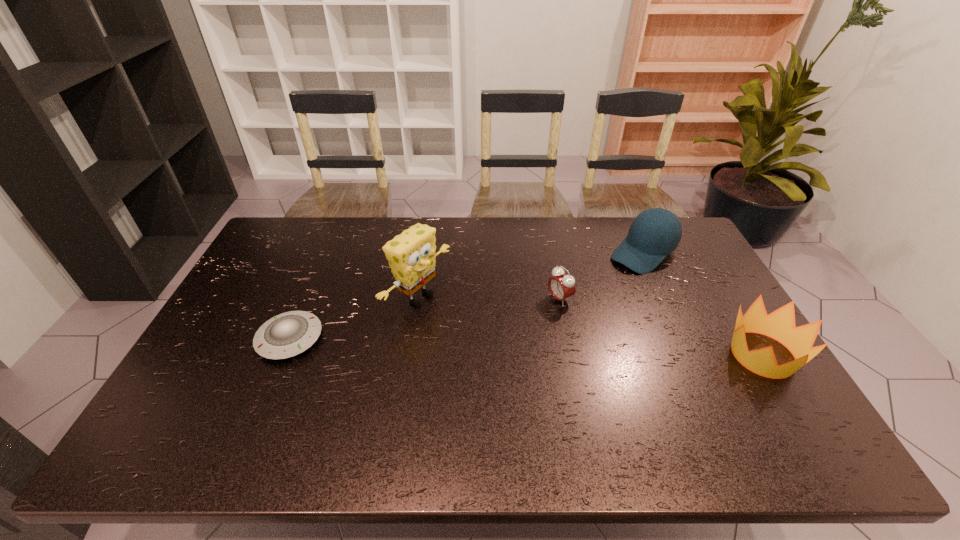
Where is `the third closest object to the saucer`? This screenshot has height=540, width=960. the third closest object to the saucer is located at coordinates (656, 232).

Choose which object is the third nearest neighbor to the third object from right to left. Please provide its 2D coordinates. Your answer should be formatted as a tuple, i.e. [(x, y)], where the tuple contains the x and y coordinates of a point satisfying the conditions above.

[(780, 325)]

Where is `blank space that satisfies the following two spatial constraints: 1. on the back side of the tallest object; 2. on the left side of the saucer`? blank space that satisfies the following two spatial constraints: 1. on the back side of the tallest object; 2. on the left side of the saucer is located at coordinates (307, 298).

This screenshot has height=540, width=960. I want to click on free space that satisfies the following two spatial constraints: 1. on the back side of the tallest object; 2. on the left side of the shortest object, so click(x=307, y=298).

The width and height of the screenshot is (960, 540). Find the location of `vacant region that satisfies the following two spatial constraints: 1. on the back side of the alarm clock; 2. on the left side of the baseball cap`. vacant region that satisfies the following two spatial constraints: 1. on the back side of the alarm clock; 2. on the left side of the baseball cap is located at coordinates (551, 253).